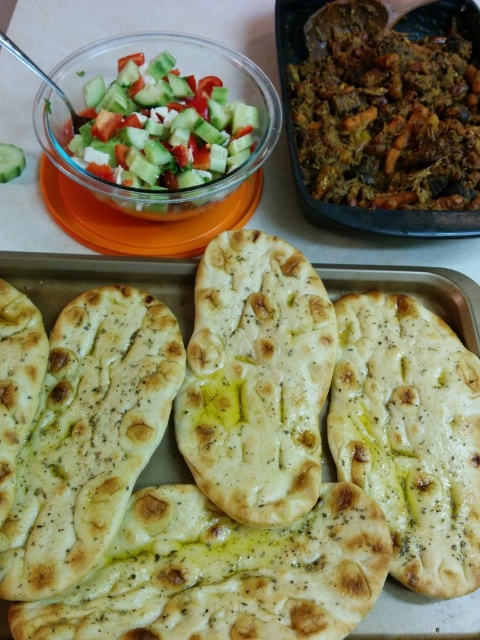
Between olive oil brushed flatbread at center and fresh green salad at upper left, which one is positioned lower?

olive oil brushed flatbread at center

Between point (226, 422) and point (188, 182), which one is positioned behind?

Point (188, 182)

Identify the location of olive oil brushed flatbread at center. Image resolution: width=480 pixels, height=640 pixels. (255, 378).

Is white soft flatbread at center above green cucumber at upper left?

Incorrect, white soft flatbread at center is not positioned above green cucumber at upper left.

Measure the distance from white soft flatbread at center to green cucumber at upper left.

They are 17.89 inches apart.

Is point (357, 637) farther from camera compared to point (13, 173)?

No.

In order to click on white soft flatbread at center in this screenshot , I will do `click(98, 280)`.

Is brown textured stew at upper right to the left of white soft flatbread at center from the viewer's perspective?

Incorrect, brown textured stew at upper right is not on the left side of white soft flatbread at center.

How distant is brown textured stew at upper right from white soft flatbread at center?

brown textured stew at upper right and white soft flatbread at center are 11.77 inches apart.

What do you see at coordinates (385, 115) in the screenshot? This screenshot has width=480, height=640. I see `brown textured stew at upper right` at bounding box center [385, 115].

Identify the location of brown textured stew at upper right. Image resolution: width=480 pixels, height=640 pixels. (385, 115).